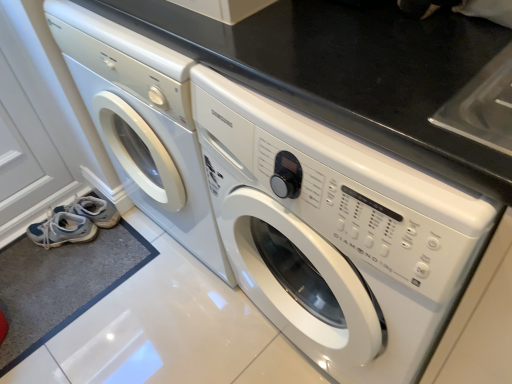
This screenshot has width=512, height=384. Identify the location of free point to the left of light blue fabric shoe at lower left, which is the first shoe from bottom to top. (23, 252).